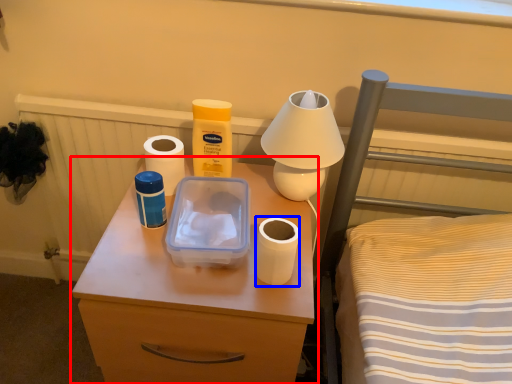
Question: Which object appears farthest to the camera in this image, nightstand (highlighted by a red box) or toilet paper (highlighted by a blue box)?

Choices:
 (A) nightstand
 (B) toilet paper

Answer: (B)